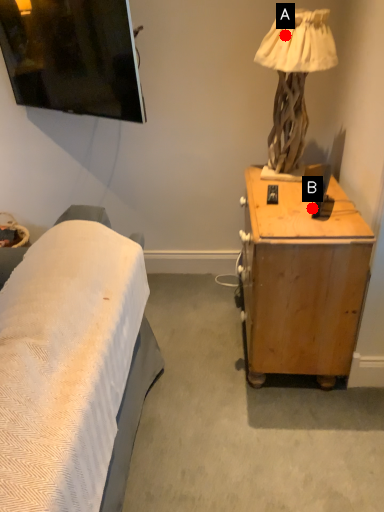
Question: Two points are circled on the image, labeled by A and B beside each circle. Which of the following is the farthest from the observer?

Choices:
 (A) A is further
 (B) B is further

Answer: (A)